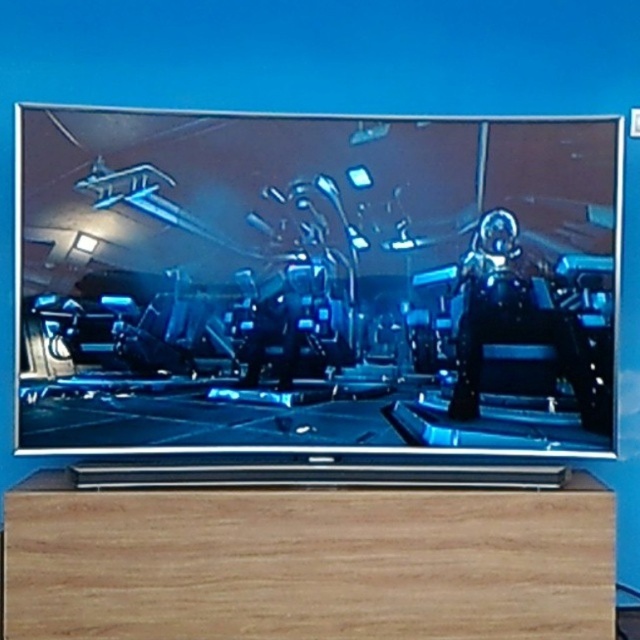
Question: Which point appears farthest from the camera in this image?

Choices:
 (A) (612, 497)
 (B) (136, 241)

Answer: (B)

Question: Is glossy metallic spaceship at center further to the viewer compared to wooden drawer at bottom?

Choices:
 (A) no
 (B) yes

Answer: (B)

Question: Can you confirm if glossy metallic spaceship at center is positioned above wooden drawer at bottom?

Choices:
 (A) yes
 (B) no

Answer: (A)

Question: Does glossy metallic spaceship at center appear under wooden drawer at bottom?

Choices:
 (A) no
 (B) yes

Answer: (A)

Question: Among these points, which one is nearest to the camera?

Choices:
 (A) 580,164
 (B) 410,499

Answer: (B)